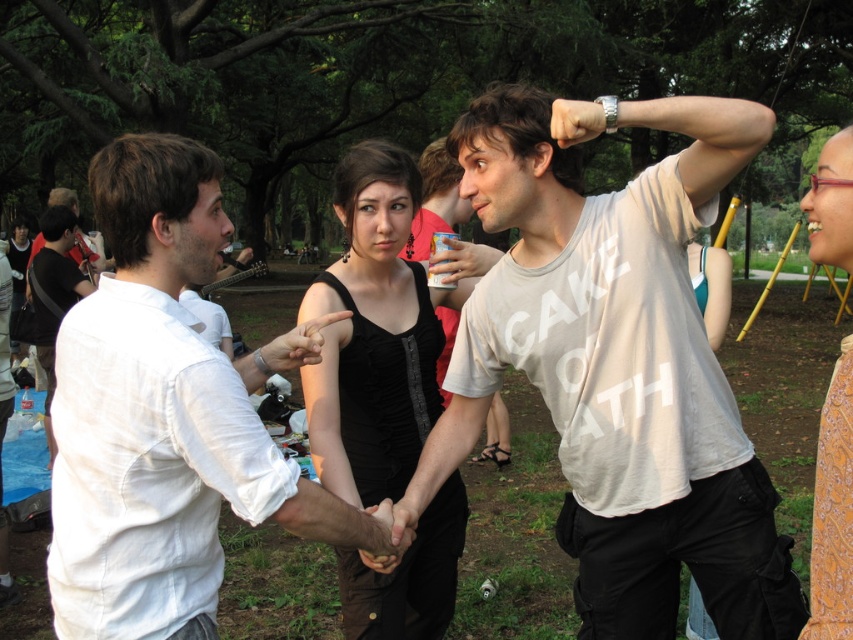
Question: Can you confirm if black matte dress at center is thinner than black satin dress at center?

Choices:
 (A) no
 (B) yes

Answer: (B)

Question: Which point is farther from the camera taking this photo?

Choices:
 (A) (86, 307)
 (B) (569, 172)
 (C) (352, 568)
 (D) (39, 248)

Answer: (D)

Question: Which point is closer to the camera taking this photo?

Choices:
 (A) (94, 243)
 (B) (358, 355)
 (C) (840, 580)

Answer: (C)

Question: Observing the image, what is the correct spatial positioning of light beige cotton t-shirt at center in reference to black satin dress at center?

Choices:
 (A) above
 (B) below

Answer: (B)

Question: Can you confirm if matte gold scarf at upper right is wider than black satin dress at center?

Choices:
 (A) yes
 (B) no

Answer: (A)

Question: Which is nearer to the black matte dress at center?

Choices:
 (A) black satin dress at center
 (B) white cotton shirt at center

Answer: (B)